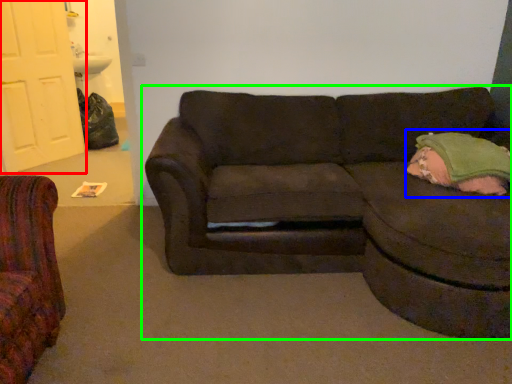
Question: Which is farther away from door (highlighted by a red box)? pillow (highlighted by a blue box) or studio couch (highlighted by a green box)?

Choices:
 (A) pillow
 (B) studio couch

Answer: (A)